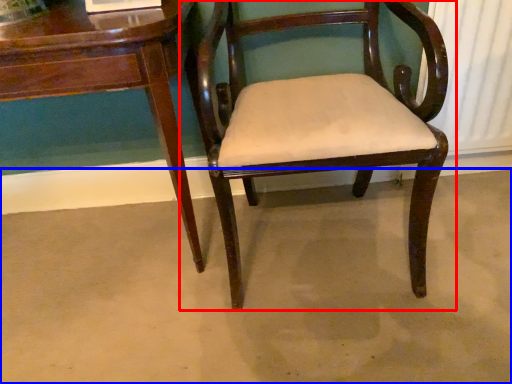
Question: Which object is closer to the camera taking this photo, chair (highlighted by a red box) or concrete (highlighted by a blue box)?

Choices:
 (A) chair
 (B) concrete

Answer: (A)